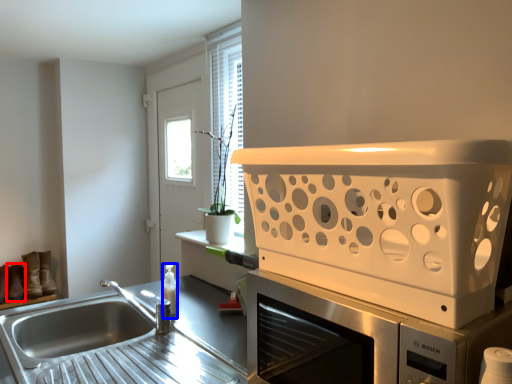
Question: Which point is closer to the camera, shoe (highlighted by a red box) or bottle (highlighted by a blue box)?

Choices:
 (A) shoe
 (B) bottle

Answer: (B)